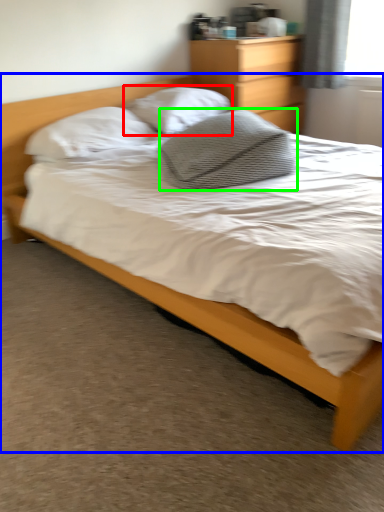
Question: Based on their relative distances, which object is nearer to pillow (highlighted by a red box)? Choose from bed (highlighted by a blue box) and pillow (highlighted by a green box).

Choices:
 (A) bed
 (B) pillow

Answer: (B)